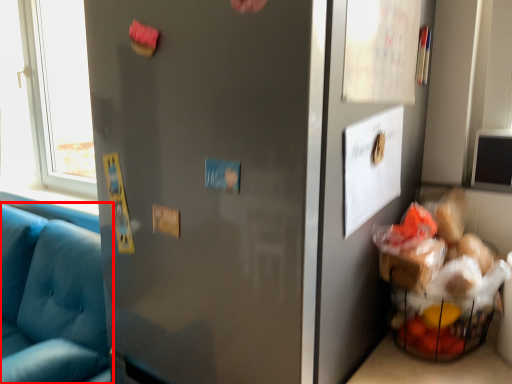
Question: Where is studio couch (annotated by the red box) located in relation to door in the image?

Choices:
 (A) left
 (B) right

Answer: (A)